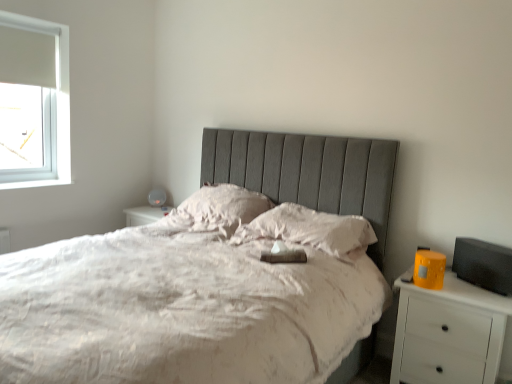
Question: Is silky white pillow at center, which appears as the 1th pillow when viewed from the right, bigger or smaller than white matte nightstand at right?

Choices:
 (A) small
 (B) big

Answer: (A)

Question: Considering the positions of point (253, 225) and point (416, 324), is point (253, 225) closer or farther from the camera than point (416, 324)?

Choices:
 (A) closer
 (B) farther

Answer: (B)

Question: Which object is the closest to the matte gray table lamp at upper center?

Choices:
 (A) silky white pillow at center, placed as the 2th pillow when sorted from left to right
 (B) white matte nightstand at right
 (C) white soft pillow at center, which ranks as the 1th pillow in left-to-right order

Answer: (C)

Question: Which is farther from the white matte nightstand at right?

Choices:
 (A) white soft pillow at center, which ranks as the 1th pillow in left-to-right order
 (B) matte gray table lamp at upper center
 (C) silky white pillow at center, which appears as the 1th pillow when viewed from the right

Answer: (B)